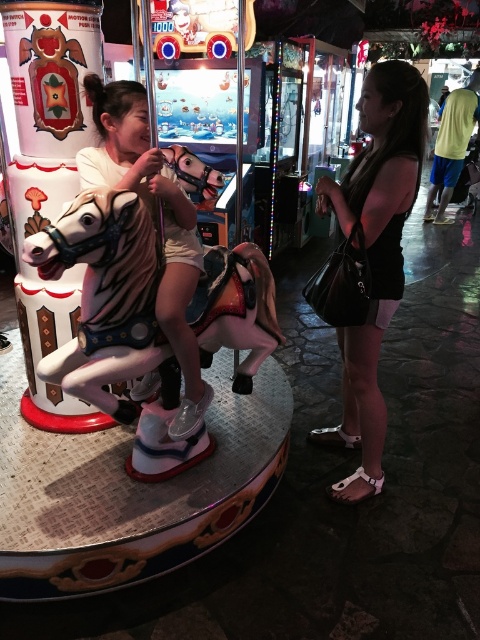
Question: Estimate the real-world distances between objects in this image. Which object is farther from the matte white horse at center?

Choices:
 (A) shiny pink horse at center
 (B) black leather handbag at center

Answer: (B)

Question: Among these points, which one is nearest to the camera?

Choices:
 (A) (66, 387)
 (B) (380, 173)
 (C) (179, 212)

Answer: (A)

Question: Considering the relative positions of black leather handbag at center and matte white horse at center in the image provided, where is black leather handbag at center located with respect to matte white horse at center?

Choices:
 (A) right
 (B) left

Answer: (A)

Question: Does black leather handbag at center have a smaller size compared to matte white horse at center?

Choices:
 (A) no
 (B) yes

Answer: (A)

Question: Based on their relative distances, which object is farther from the matte white horse at center?

Choices:
 (A) black leather handbag at center
 (B) shiny pink horse at center

Answer: (A)

Question: Is shiny pink horse at center to the left of matte white horse at center from the viewer's perspective?

Choices:
 (A) yes
 (B) no

Answer: (B)